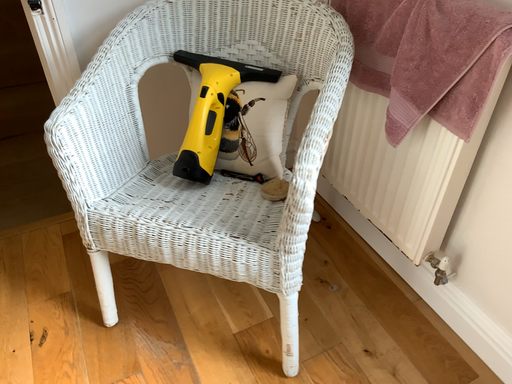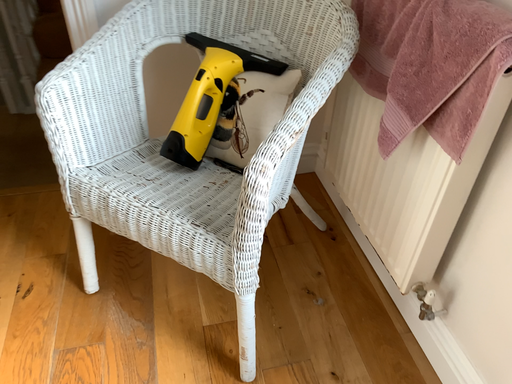
Question: How did the camera likely rotate when shooting the video?

Choices:
 (A) rotated right
 (B) rotated left

Answer: (B)